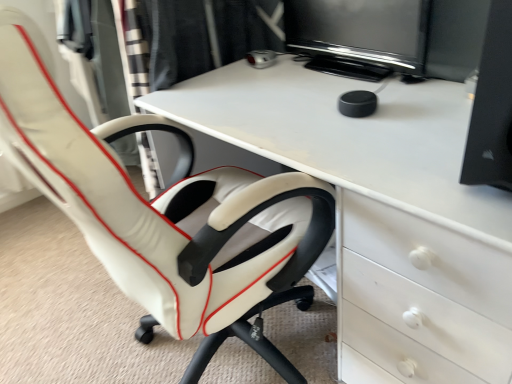
Question: Choose the correct answer: Is white leather chair at left inside white glossy desk at center or outside it?

Choices:
 (A) inside
 (B) outside

Answer: (B)

Question: Considering their positions, is white leather chair at left located in front of or behind white glossy desk at center?

Choices:
 (A) behind
 (B) front

Answer: (B)

Question: Estimate the real-world distances between objects in this image. Which object is farther from the white glossy desk at center?

Choices:
 (A) white leather chair at left
 (B) black glossy monitor at upper center

Answer: (B)

Question: Which of these objects is positioned farthest from the white glossy desk at center?

Choices:
 (A) black glossy monitor at upper center
 (B) white leather chair at left

Answer: (A)